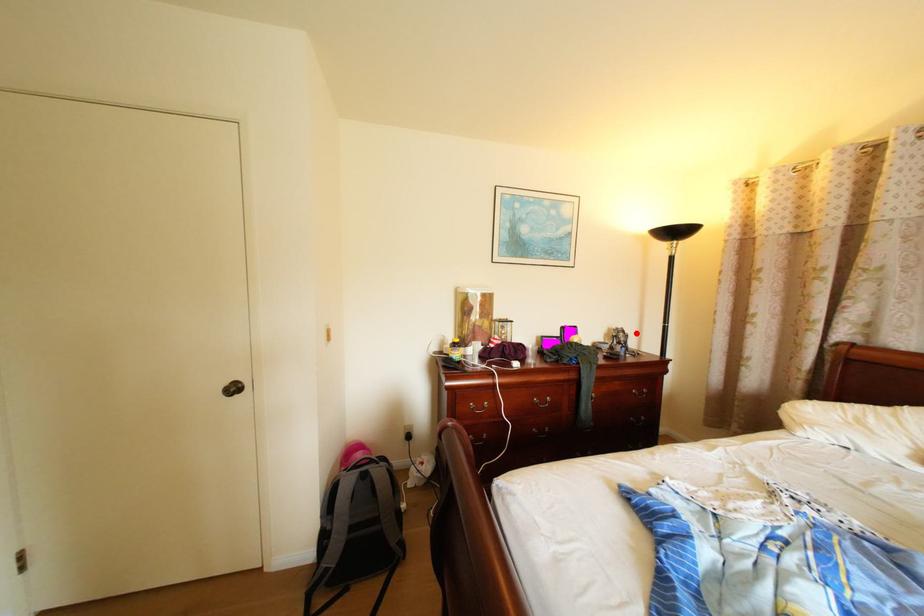
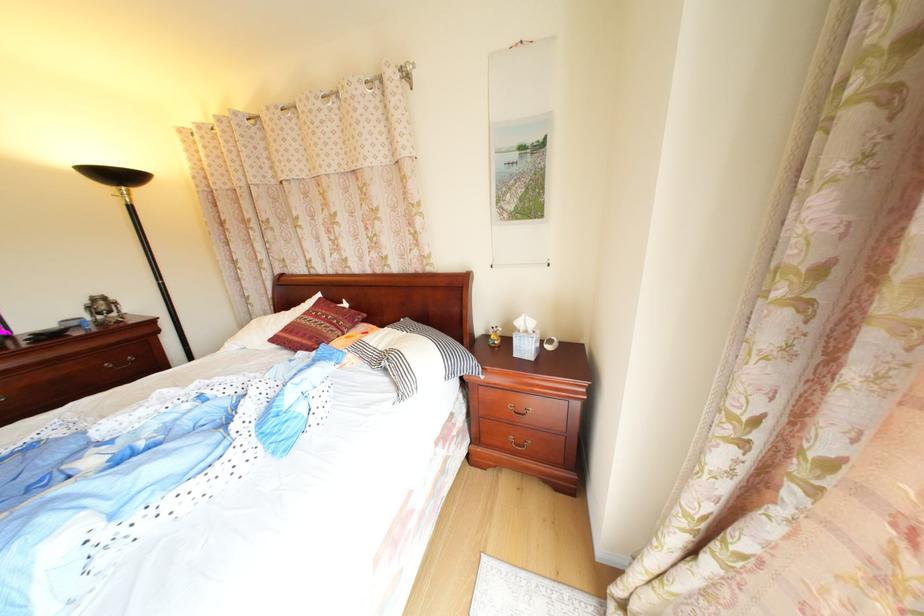
Locate, in the second image, the point that corresponds to the highlighted location in the first image.

(116, 301)